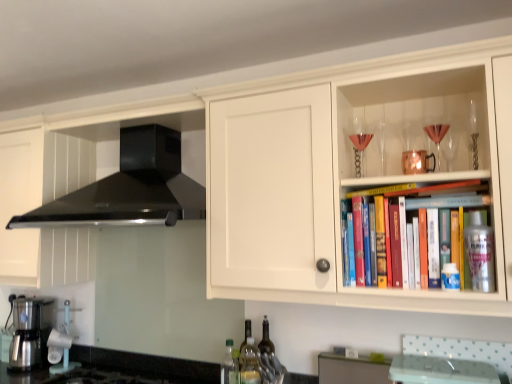
Question: Is metallic silver spray can at upper right, arranged as the 1th bottle when viewed from the front, looking in the opposite direction of translucent glass bottle at lower center, which is the third bottle from left to right?

Choices:
 (A) no
 (B) yes

Answer: (A)

Question: Is metallic silver spray can at upper right, arranged as the 1th bottle when viewed from the front, beside translucent glass bottle at lower center, arranged as the 1th bottle when viewed from the back?

Choices:
 (A) yes
 (B) no

Answer: (B)

Question: Is translucent glass bottle at lower center, acting as the 4th bottle starting from the front, surrounded by metallic silver spray can at upper right, the first bottle positioned from the right?

Choices:
 (A) yes
 (B) no

Answer: (B)

Question: Is metallic silver spray can at upper right, the 4th bottle positioned from the left, positioned beyond the bounds of translucent glass bottle at lower center, acting as the 4th bottle starting from the front?

Choices:
 (A) yes
 (B) no

Answer: (A)

Question: From the image's perspective, does metallic silver spray can at upper right, which appears as the 4th bottle when viewed from the back, appear lower than translucent glass bottle at lower center, which is the third bottle from left to right?

Choices:
 (A) yes
 (B) no

Answer: (B)

Question: Relative to black matte range hood at upper left, is black granite countertop at lower left in front or behind?

Choices:
 (A) front
 (B) behind

Answer: (A)

Question: Considering the relative positions of black granite countertop at lower left and black matte range hood at upper left in the image provided, is black granite countertop at lower left to the left or to the right of black matte range hood at upper left?

Choices:
 (A) right
 (B) left

Answer: (A)

Question: Considering the positions of point (201, 365) and point (141, 150), is point (201, 365) closer or farther from the camera than point (141, 150)?

Choices:
 (A) farther
 (B) closer

Answer: (B)

Question: Considering the positions of black granite countertop at lower left and black matte range hood at upper left in the image, is black granite countertop at lower left wider or thinner than black matte range hood at upper left?

Choices:
 (A) wide
 (B) thin

Answer: (A)

Question: Choose the correct answer: Is white wood cabinet at upper right, which is counted as the 2th cabinetry, starting from the right, inside translucent plastic bottle at lower center, the 3th bottle when ordered from front to back, or outside it?

Choices:
 (A) outside
 (B) inside

Answer: (A)

Question: Would you say white wood cabinet at upper right, marked as the first cabinetry in a left-to-right arrangement, is to the left or to the right of translucent plastic bottle at lower center, arranged as the third bottle when viewed from the right, in the picture?

Choices:
 (A) left
 (B) right

Answer: (A)

Question: From the image's perspective, is white wood cabinet at upper right, the second cabinetry from the back, above or below translucent plastic bottle at lower center, arranged as the third bottle when viewed from the right?

Choices:
 (A) above
 (B) below

Answer: (A)

Question: From a real-world perspective, relative to translucent plastic bottle at lower center, the 3th bottle when ordered from front to back, is white wood cabinet at upper right, the second cabinetry from the back, vertically above or below?

Choices:
 (A) above
 (B) below

Answer: (A)

Question: Visually, is metallic silver coffee maker at lower left positioned to the left or to the right of black matte range hood at upper left?

Choices:
 (A) left
 (B) right

Answer: (A)

Question: From their relative heights in the image, would you say metallic silver coffee maker at lower left is taller or shorter than black matte range hood at upper left?

Choices:
 (A) short
 (B) tall

Answer: (A)